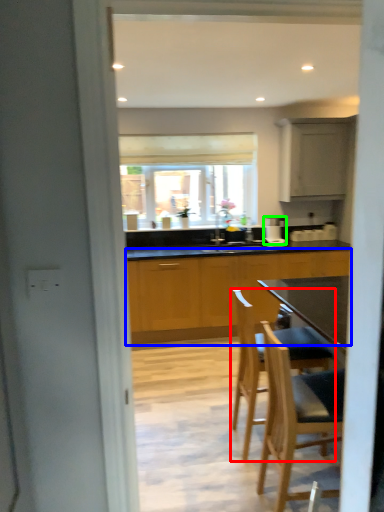
Question: Estimate the real-world distances between objects in this image. Which object is farther from chair (highlighted by a red box), cabinetry (highlighted by a blue box) or coffee machine (highlighted by a green box)?

Choices:
 (A) cabinetry
 (B) coffee machine

Answer: (B)